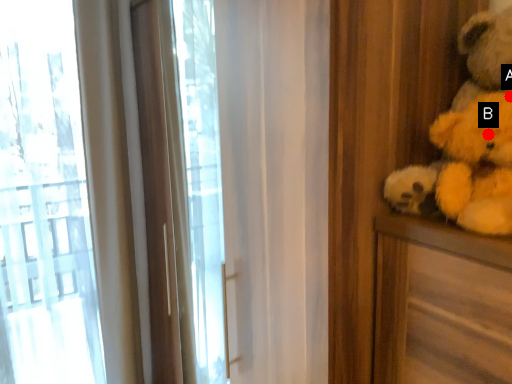
Question: Two points are circled on the image, labeled by A and B beside each circle. Which point is closer to the camera?

Choices:
 (A) A is closer
 (B) B is closer

Answer: (A)